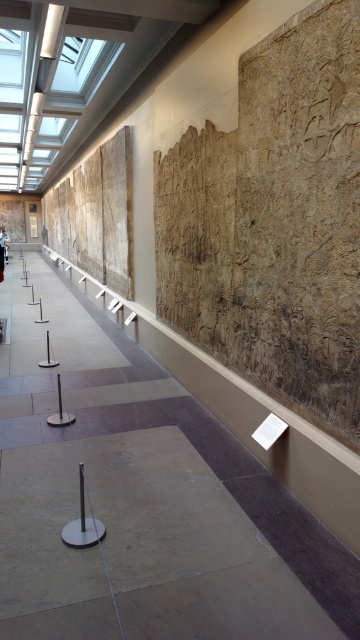
You are standing in the museum and want to take a photo of the ancient stone reliefs. The museum requires visitors to maintain a minimum distance of 2 meters from the displayed artifacts. If you are currently at point (81, 493), which is 2.49 meters away from the reliefs, are you compliant with the museum rules?

Yes, you are compliant with the museum rules because the distance of point (81, 493) from the reliefs is 2.49 meters, which is greater than the required minimum of 2 meters.